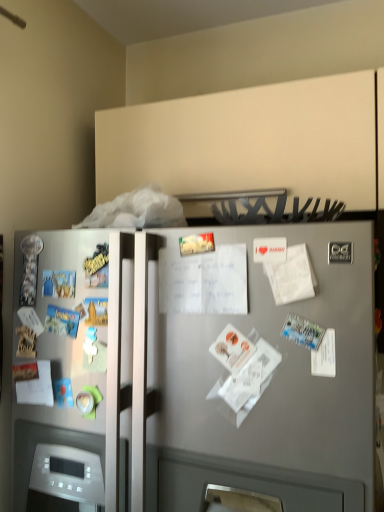
Question: From the image's perspective, does satin silver refrigerator at center appear higher than white matte paper at center-right, the 1th paper viewed from the top?

Choices:
 (A) no
 (B) yes

Answer: (A)

Question: Is there a large distance between satin silver refrigerator at center and white matte paper at center-right, the first paper when ordered from right to left?

Choices:
 (A) yes
 (B) no

Answer: (B)

Question: Does satin silver refrigerator at center turn towards white matte paper at center-right, the first paper when ordered from right to left?

Choices:
 (A) no
 (B) yes

Answer: (B)

Question: From a real-world perspective, is satin silver refrigerator at center under white matte paper at center-right, the third paper from the left?

Choices:
 (A) no
 (B) yes

Answer: (B)

Question: Does satin silver refrigerator at center appear on the left side of white matte paper at center-right, the first paper when ordered from right to left?

Choices:
 (A) yes
 (B) no

Answer: (A)

Question: Considering the positions of point (233, 404) and point (236, 451), is point (233, 404) closer or farther from the camera than point (236, 451)?

Choices:
 (A) closer
 (B) farther

Answer: (B)

Question: From the image's perspective, is white paper at center, which ranks as the second paper in top-to-bottom order, positioned above or below satin silver refrigerator at center?

Choices:
 (A) above
 (B) below

Answer: (A)

Question: Based on their sizes in the image, would you say white paper at center, which appears as the 3th paper when viewed from the back, is bigger or smaller than satin silver refrigerator at center?

Choices:
 (A) big
 (B) small

Answer: (B)

Question: From a real-world perspective, is white paper at center, which ranks as the second paper in top-to-bottom order, physically located above or below satin silver refrigerator at center?

Choices:
 (A) below
 (B) above

Answer: (B)

Question: From the image's perspective, is white paper at center, which appears as the 3th paper when viewed from the back, above or below white matte paper at center-right, the first paper when ordered from right to left?

Choices:
 (A) below
 (B) above

Answer: (A)

Question: From a real-world perspective, is white paper at center, which ranks as the second paper in top-to-bottom order, above or below white matte paper at center-right, marked as the third paper in a bottom-to-top arrangement?

Choices:
 (A) above
 (B) below

Answer: (B)

Question: Choose the correct answer: Is white paper at center, which ranks as the 2th paper in left-to-right order, inside white matte paper at center-right, marked as the third paper in a bottom-to-top arrangement, or outside it?

Choices:
 (A) outside
 (B) inside

Answer: (A)

Question: Is white paper at center, which appears as the 3th paper when viewed from the back, taller or shorter than white matte paper at center-right, placed as the second paper when sorted from front to back?

Choices:
 (A) short
 (B) tall

Answer: (B)

Question: In terms of width, does white matte paper at center-right, the 1th paper viewed from the top, look wider or thinner when compared to white paper at left, which is counted as the 1th paper, starting from the bottom?

Choices:
 (A) wide
 (B) thin

Answer: (B)

Question: From a real-world perspective, is white matte paper at center-right, marked as the third paper in a bottom-to-top arrangement, positioned above or below white paper at left, arranged as the 3th paper when viewed from the front?

Choices:
 (A) above
 (B) below

Answer: (A)